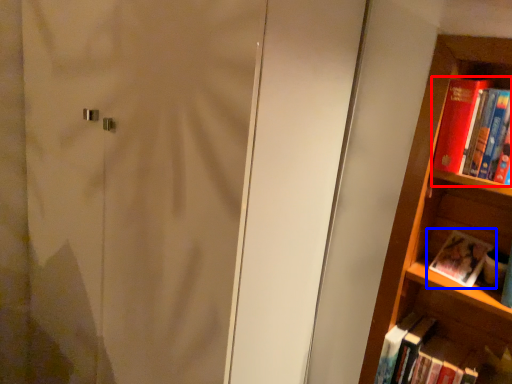
Question: Which point is further to the camera, book (highlighted by a red box) or book (highlighted by a blue box)?

Choices:
 (A) book
 (B) book

Answer: (B)